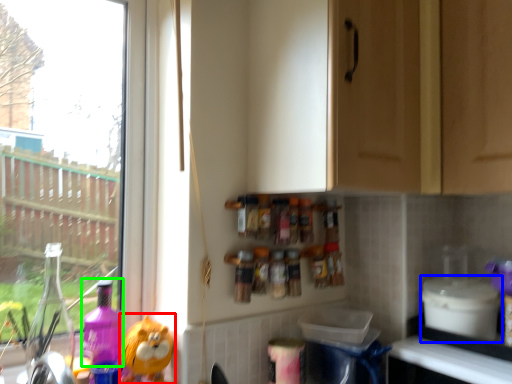
Question: Based on their relative distances, which object is nearer to toy (highlighted by a red box)? Choose from appliance (highlighted by a blue box) and cleaning product (highlighted by a green box).

Choices:
 (A) appliance
 (B) cleaning product

Answer: (B)